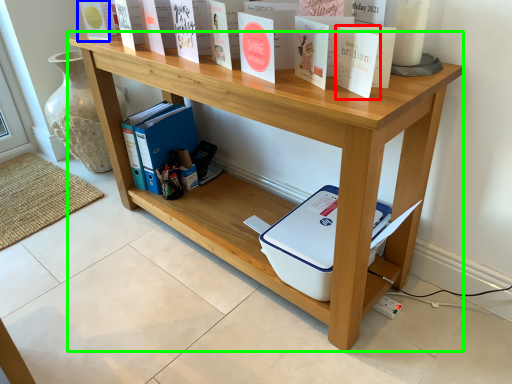
Question: Which is farther away from paperback book (highlighted by a red box)? paperback book (highlighted by a blue box) or shelf (highlighted by a green box)?

Choices:
 (A) paperback book
 (B) shelf

Answer: (A)